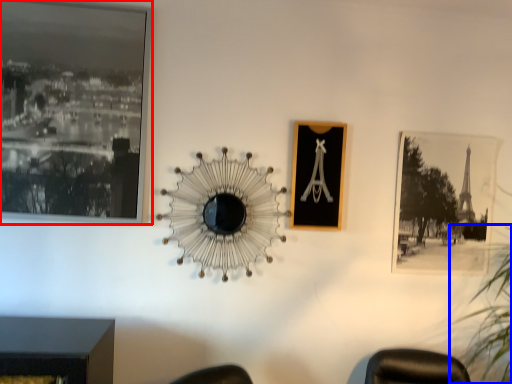
Question: Which point is closer to the camera, picture frame (highlighted by a red box) or plant (highlighted by a blue box)?

Choices:
 (A) picture frame
 (B) plant

Answer: (B)